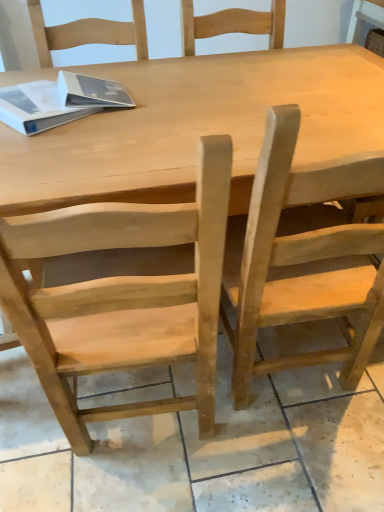
Question: Is white matte book at upper left wider than natural wood chair at right, marked as the 2th chair in a left-to-right arrangement?

Choices:
 (A) no
 (B) yes

Answer: (A)

Question: Considering the relative sizes of white matte book at upper left and natural wood chair at right, which ranks as the 1th chair in right-to-left order, in the image provided, is white matte book at upper left bigger than natural wood chair at right, which ranks as the 1th chair in right-to-left order,?

Choices:
 (A) no
 (B) yes

Answer: (A)

Question: Is white matte book at upper left to the right of natural wood chair at right, which ranks as the 1th chair in right-to-left order, from the viewer's perspective?

Choices:
 (A) no
 (B) yes

Answer: (A)

Question: Is the position of white matte book at upper left less distant than that of natural wood chair at right, marked as the 2th chair in a left-to-right arrangement?

Choices:
 (A) no
 (B) yes

Answer: (A)

Question: Is white matte book at upper left not near natural wood chair at right, marked as the 2th chair in a left-to-right arrangement?

Choices:
 (A) yes
 (B) no

Answer: (B)

Question: From a real-world perspective, does white matte book at upper left sit lower than natural wood chair at right, marked as the 2th chair in a left-to-right arrangement?

Choices:
 (A) no
 (B) yes

Answer: (A)

Question: Does natural wood chair at right, which ranks as the 1th chair in right-to-left order, lie behind natural wood chair at center, the first chair when ordered from left to right?

Choices:
 (A) no
 (B) yes

Answer: (B)

Question: Is natural wood chair at right, marked as the 2th chair in a left-to-right arrangement, smaller than natural wood chair at center, which ranks as the second chair in right-to-left order?

Choices:
 (A) no
 (B) yes

Answer: (B)

Question: From a real-world perspective, is natural wood chair at right, marked as the 2th chair in a left-to-right arrangement, physically below natural wood chair at center, which ranks as the second chair in right-to-left order?

Choices:
 (A) no
 (B) yes

Answer: (A)

Question: Is the position of natural wood chair at right, which ranks as the 1th chair in right-to-left order, less distant than that of natural wood chair at center, the first chair when ordered from left to right?

Choices:
 (A) no
 (B) yes

Answer: (A)

Question: Would you say natural wood chair at right, which ranks as the 1th chair in right-to-left order, is outside natural wood chair at center, the first chair when ordered from left to right?

Choices:
 (A) yes
 (B) no

Answer: (A)

Question: Is natural wood chair at right, marked as the 2th chair in a left-to-right arrangement, at the right side of natural wood chair at center, the first chair when ordered from left to right?

Choices:
 (A) no
 (B) yes

Answer: (B)

Question: Does natural wood table at center have a smaller size compared to natural wood chair at right, marked as the 2th chair in a left-to-right arrangement?

Choices:
 (A) yes
 (B) no

Answer: (B)